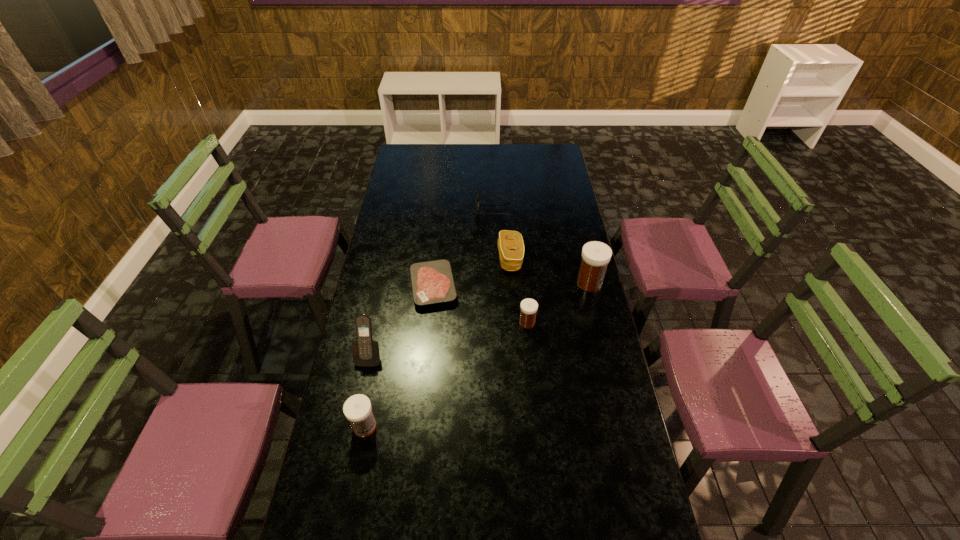
Locate an element on the screen. This screenshot has height=540, width=960. clutch bag is located at coordinates (510, 244).

Find the location of a particular element. Image resolution: width=960 pixels, height=540 pixels. the sixth farthest object is located at coordinates (366, 353).

Identify the location of free space located on the right of the nearest medicine. The image size is (960, 540). (446, 427).

I want to click on free space located on the left of the third nearest object, so click(500, 322).

Find the location of a particular element. vacant region located on the left of the rightmost object is located at coordinates (495, 283).

You are a GUI agent. You are given a task and a screenshot of the screen. Output one action in this format:
    pyautogui.click(x=<x>, y=<y>)
    Task: Click on the vacant space located 0.380m on the back of the shortest object
    
    Given the screenshot: What is the action you would take?
    pyautogui.click(x=441, y=208)

Identify the location of vacant space positioned on the front-facing side of the sixth tallest object. The height and width of the screenshot is (540, 960). (462, 209).

Locate an element on the screen. This screenshot has height=540, width=960. vacant region located on the front-facing side of the sixth tallest object is located at coordinates (407, 209).

Identify the location of vacant space positioned on the front-facing side of the sixth tallest object. (430, 209).

Identify the location of free space located 0.290m on the zipper side of the clutch bag. (429, 259).